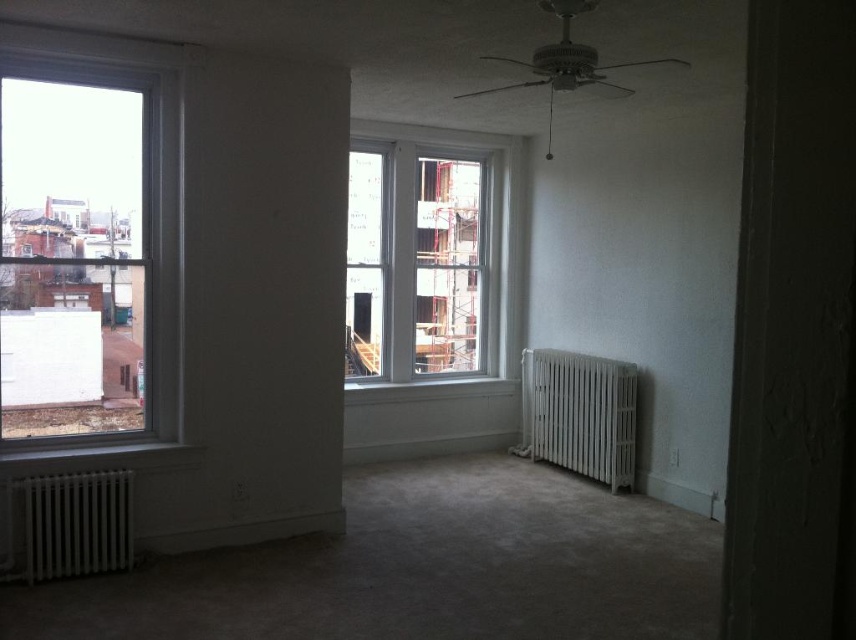
In the scene shown: You are standing in the room and want to look out through the clear glass window at left and the white wooden window at center. Which window will give you a clearer view of the outside urban environment?

The clear glass window at left is in front of the white wooden window at center, so it will provide a clearer view of the outside urban environment since it is not obstructed by the other window.

You are an interior designer planning to place a large sofa between the white matte radiator at lower right and the white matte radiator at lower left. Considering their sizes, which radiator will require more space for the sofa to be placed comfortably?

The white matte radiator at lower right has a larger size compared to the white matte radiator at lower left, so it will require more space for the sofa to be placed comfortably.